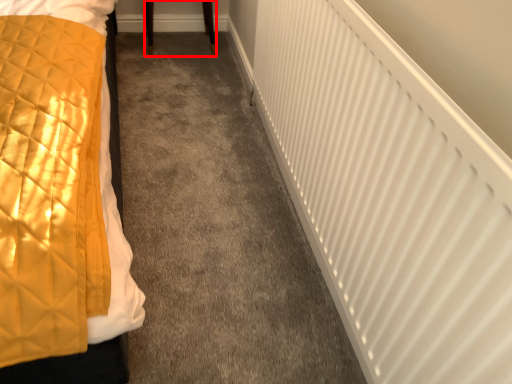
Question: From the image's perspective, what is the correct spatial relationship of furniture (annotated by the red box) in relation to radiator?

Choices:
 (A) below
 (B) above

Answer: (B)